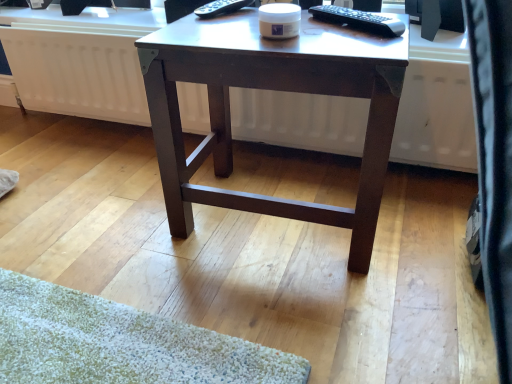
Question: Can you confirm if black glossy monitor at upper right is bigger than white matte radiator at center?

Choices:
 (A) yes
 (B) no

Answer: (B)

Question: Can you confirm if black glossy monitor at upper right is smaller than white matte radiator at center?

Choices:
 (A) no
 (B) yes

Answer: (B)

Question: Does black glossy monitor at upper right have a lesser height compared to white matte radiator at center?

Choices:
 (A) no
 (B) yes

Answer: (B)

Question: From the image's perspective, would you say black glossy monitor at upper right is positioned over white matte radiator at center?

Choices:
 (A) yes
 (B) no

Answer: (A)

Question: Is black glossy monitor at upper right located outside white matte radiator at center?

Choices:
 (A) yes
 (B) no

Answer: (A)

Question: Looking at the image, does black plastic remote control at upper right, the 1th remote control positioned from the right, seem bigger or smaller compared to dark brown wood desk at center?

Choices:
 (A) big
 (B) small

Answer: (B)

Question: Is point (366, 26) closer or farther from the camera than point (329, 44)?

Choices:
 (A) farther
 (B) closer

Answer: (A)

Question: Is black plastic remote control at upper right, the second remote control when ordered from back to front, wider or thinner than dark brown wood desk at center?

Choices:
 (A) wide
 (B) thin

Answer: (B)

Question: Would you say black plastic remote control at upper right, positioned as the 1th remote control in front-to-back order, is to the left or to the right of dark brown wood desk at center in the picture?

Choices:
 (A) right
 (B) left

Answer: (A)

Question: In terms of height, does black plastic remote control at upper center, which is the second remote control in front-to-back order, look taller or shorter compared to black plastic remote control at upper right, the second remote control when ordered from back to front?

Choices:
 (A) tall
 (B) short

Answer: (A)

Question: From the image's perspective, relative to black plastic remote control at upper right, positioned as the 1th remote control in front-to-back order, is black plastic remote control at upper center, the 1th remote control positioned from the back, above or below?

Choices:
 (A) above
 (B) below

Answer: (A)

Question: From a real-world perspective, is black plastic remote control at upper center, the 2th remote control from the right, physically located above or below black plastic remote control at upper right, the second remote control in the left-to-right sequence?

Choices:
 (A) below
 (B) above

Answer: (B)

Question: Is black plastic remote control at upper center, the 1th remote control positioned from the back, inside the boundaries of black plastic remote control at upper right, positioned as the 1th remote control in front-to-back order, or outside?

Choices:
 (A) outside
 (B) inside

Answer: (A)

Question: Choose the correct answer: Is black glossy monitor at upper right inside black plastic remote control at upper center, marked as the 1th remote control in a left-to-right arrangement, or outside it?

Choices:
 (A) inside
 (B) outside

Answer: (B)

Question: Relative to black plastic remote control at upper center, the 1th remote control positioned from the back, is black glossy monitor at upper right in front or behind?

Choices:
 (A) front
 (B) behind

Answer: (B)